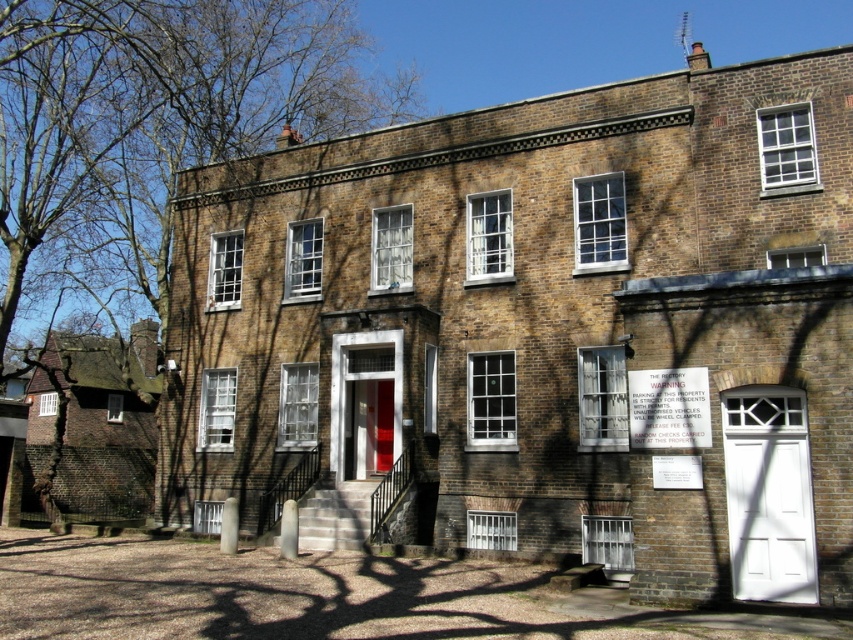
You are standing in front of the two story brick building. You see a point marked at coordinates (158, 125). What is located at that point?

The point at coordinates (158, 125) indicates bare branches at left.

You are standing in front of the two story brick building. You need to enter the white matte door at lower right but there are bare branches at left in the way. Can you walk through to the door without touching the branches?

The bare branches at left might be wider than white matte door at lower right, so there is a possibility that the branches are blocking the path to the door. You may need to move them aside or find another route to avoid contact.